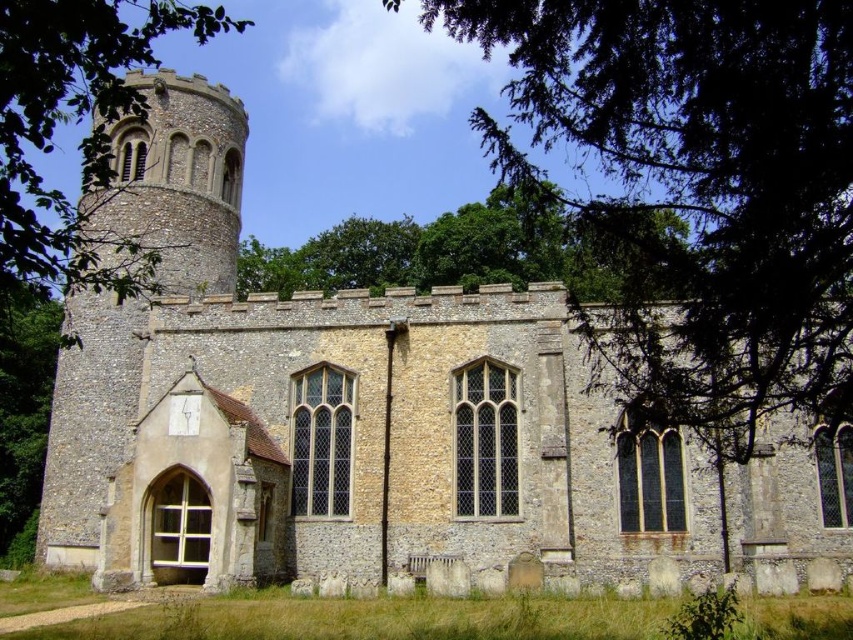
Question: Is green leafy tree at upper center bigger than green leafy tree at upper left?

Choices:
 (A) yes
 (B) no

Answer: (B)

Question: Which point is closer to the camera taking this photo?

Choices:
 (A) (781, 289)
 (B) (204, 259)

Answer: (A)

Question: Which of the following is the closest to the observer?

Choices:
 (A) green leafy tree at upper left
 (B) stone tower at center
 (C) green leafy tree at upper center

Answer: (C)

Question: Is the position of stone tower at center less distant than that of green leafy tree at upper left?

Choices:
 (A) yes
 (B) no

Answer: (B)

Question: Does green leafy tree at upper center have a larger size compared to green leafy tree at upper left?

Choices:
 (A) yes
 (B) no

Answer: (B)

Question: Which object is the closest to the stone tower at center?

Choices:
 (A) green leafy tree at upper center
 (B) green leafy tree at upper left

Answer: (B)